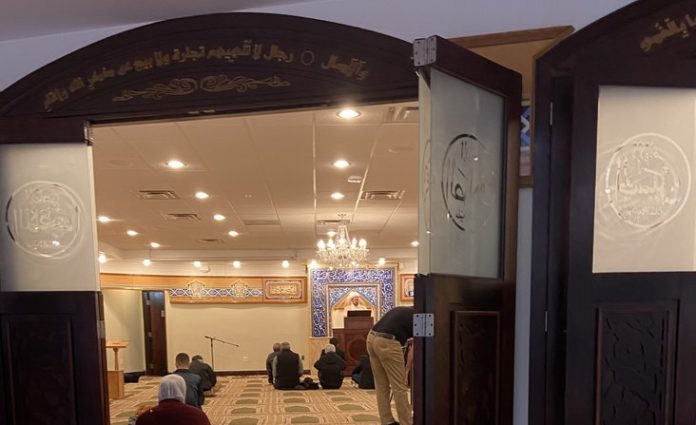
Locate an element on the screen. The height and width of the screenshot is (425, 696). chandelier is located at coordinates [x=338, y=242].